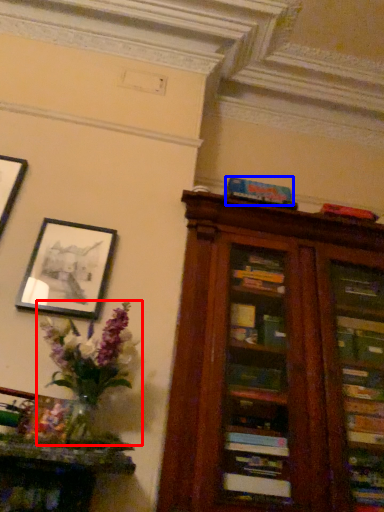
Question: Among these objects, which one is nearest to the camera, floral arrangement (highlighted by a red box) or paperback book (highlighted by a blue box)?

Choices:
 (A) floral arrangement
 (B) paperback book

Answer: (A)